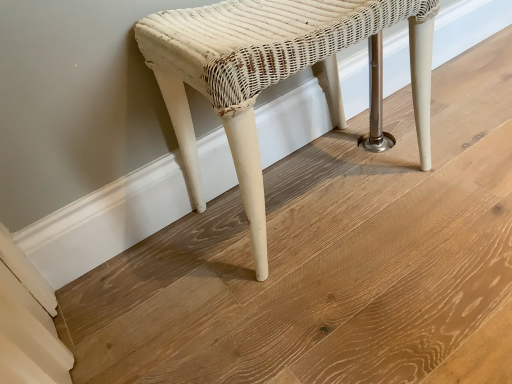
Identify the location of white wicker stool at center. The width and height of the screenshot is (512, 384). (276, 74).

Measure the distance between point (234, 52) and camera.

They are 22.56 inches apart.

This screenshot has height=384, width=512. Describe the element at coordinates (276, 74) in the screenshot. I see `white wicker stool at center` at that location.

Locate an element on the screen. The width and height of the screenshot is (512, 384). white wicker stool at center is located at coordinates (276, 74).